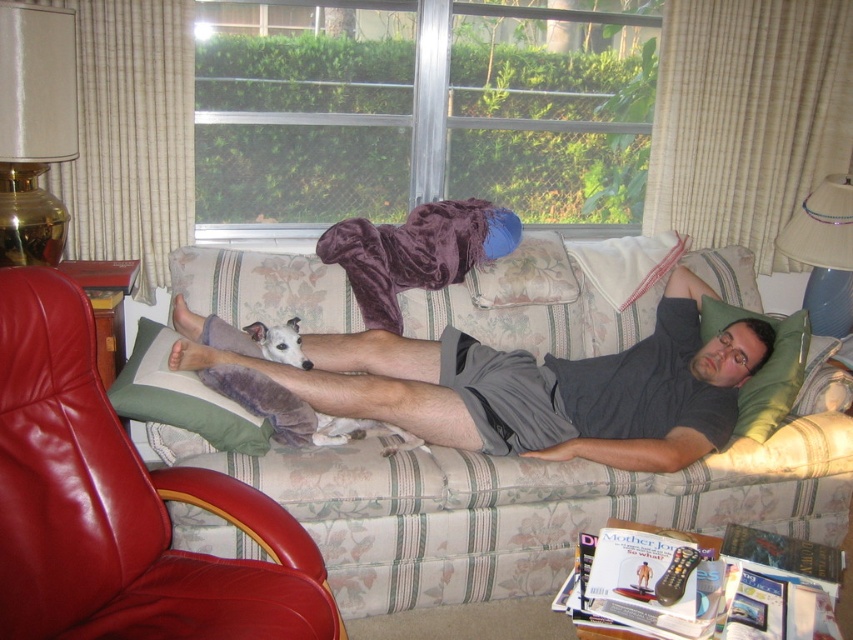
Question: Does gray cotton shorts at center appear on the right side of white fur dog at center?

Choices:
 (A) no
 (B) yes

Answer: (B)

Question: Based on their relative distances, which object is nearer to the green fabric pillow at center?

Choices:
 (A) green fabric pillow at lower left
 (B) gray cotton shorts at center
 (C) white fur dog at center

Answer: (B)

Question: Among these objects, which one is farthest from the camera?

Choices:
 (A) gray cotton shorts at center
 (B) leather armchair at lower left
 (C) green fabric pillow at lower left

Answer: (A)

Question: Which object is closer to the camera taking this photo?

Choices:
 (A) leather armchair at lower left
 (B) green fabric pillow at lower left
 (C) gray cotton shorts at center
 (D) white fur dog at center

Answer: (A)

Question: Can you confirm if floral fabric couch at center is thinner than green fabric pillow at lower left?

Choices:
 (A) yes
 (B) no

Answer: (B)

Question: Is green fabric pillow at lower left behind white fur dog at center?

Choices:
 (A) no
 (B) yes

Answer: (A)